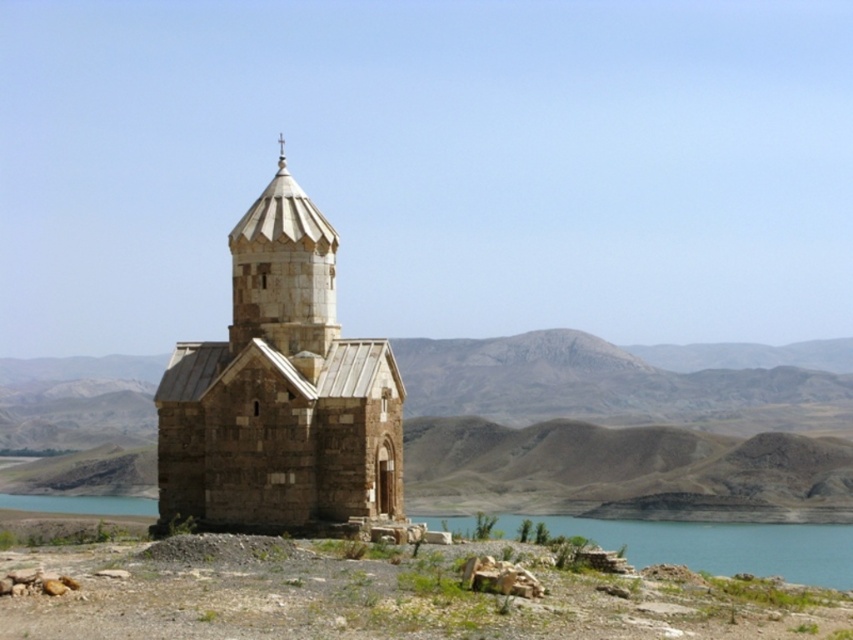
Between point (239, 241) and point (683, 540), which one is positioned in front?

Positioned in front is point (239, 241).

Does stone church at center have a larger size compared to blue water at lower center?

No, stone church at center is not bigger than blue water at lower center.

This screenshot has width=853, height=640. Identify the location of stone church at center. pos(280,392).